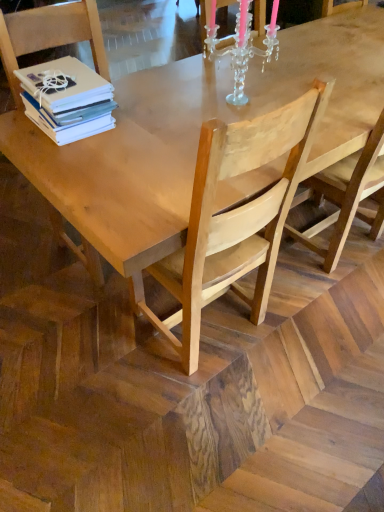
At what (x,y) coordinates should I click in order to perform the action: click on free spot in front of white matte stack of books at upper left. Please return your answer as a coordinate pair (x, y). Looking at the image, I should click on (73, 161).